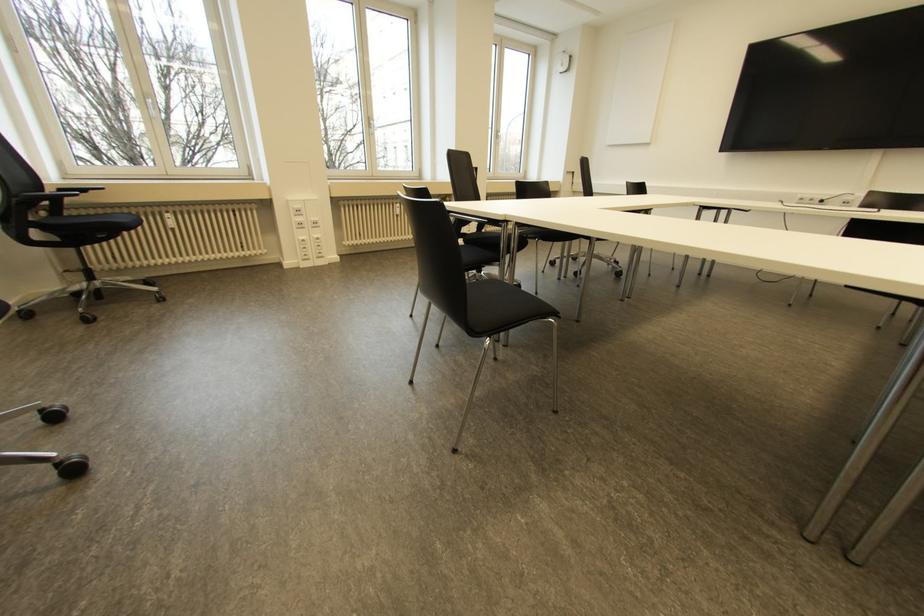
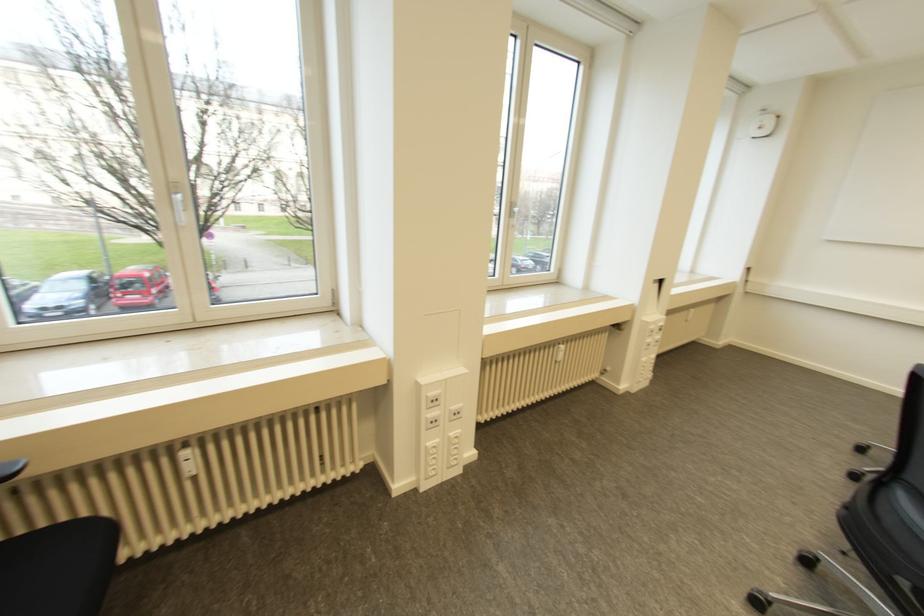
Which direction would the cameraman need to move to produce the second image?

The movement direction of the cameraman is left, forward.